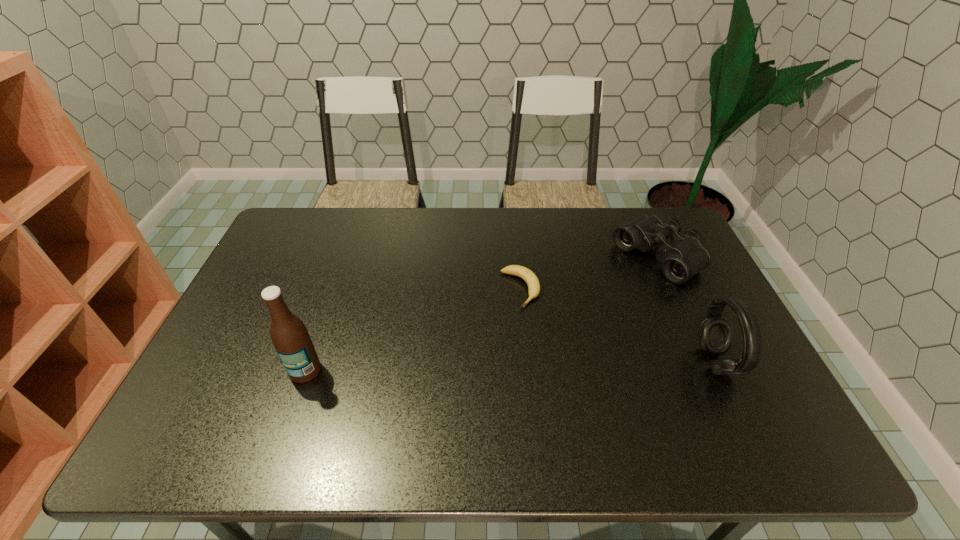
Where is `vacant position in the image that satisfies the following two spatial constraints: 1. on the back side of the third object from right to left; 2. on the left side of the binoculars`? vacant position in the image that satisfies the following two spatial constraints: 1. on the back side of the third object from right to left; 2. on the left side of the binoculars is located at coordinates (517, 258).

The height and width of the screenshot is (540, 960). In order to click on vacant region that satisfies the following two spatial constraints: 1. on the back side of the banana; 2. on the left side of the second shortest object in this screenshot , I will do `click(517, 258)`.